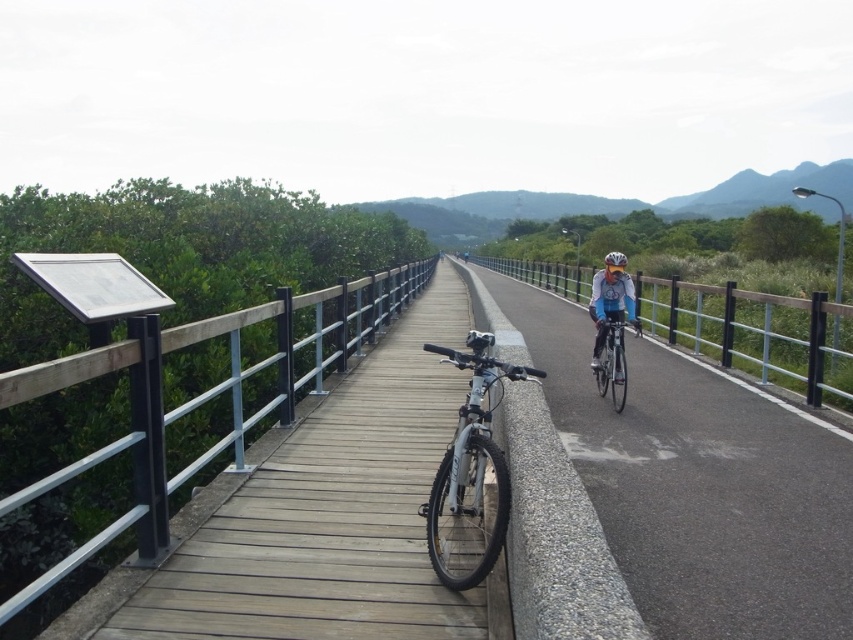
Based on the photo, between metal/textured rail at right and white matte helmet at center, which one appears on the right side from the viewer's perspective?

metal/textured rail at right is more to the right.

Is metal/textured rail at right shorter than white matte helmet at center?

In fact, metal/textured rail at right may be taller than white matte helmet at center.

Between point (512, 259) and point (602, 333), which one is positioned behind?

Positioned behind is point (512, 259).

In order to click on metal/textured rail at right in this screenshot , I will do `click(755, 333)`.

Does metal/textured rail at right have a larger size compared to shiny silver bicycle at center?

Yes.

Identify the location of metal/textured rail at right. (755, 333).

Which is more to the left, metal/textured rail at right or matte black helmet at center?

Positioned to the left is metal/textured rail at right.

Does metal/textured rail at right appear on the right side of matte black helmet at center?

In fact, metal/textured rail at right is to the left of matte black helmet at center.

Between point (563, 289) and point (614, 259), which one is positioned behind?

Point (563, 289)

The image size is (853, 640). In order to click on metal/textured rail at right in this screenshot , I will do `click(755, 333)`.